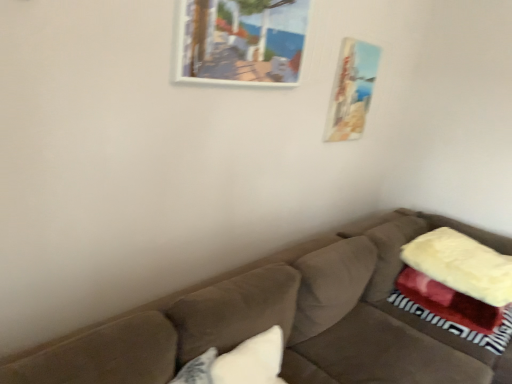
Identify the location of wooden picture frame at upper center, the 2th picture frame in the back-to-front sequence. (241, 41).

Between white soft pillow at lower center and wooden picture frame at upper center, placed as the first picture frame when sorted from front to back, which one has smaller width?

Thinner between the two is wooden picture frame at upper center, placed as the first picture frame when sorted from front to back.

Could wooden picture frame at upper center, the 2th picture frame in the back-to-front sequence, be considered to be inside white soft pillow at lower center?

No, white soft pillow at lower center does not contain wooden picture frame at upper center, the 2th picture frame in the back-to-front sequence.

Measure the distance from white soft pillow at lower center to wooden picture frame at upper center, acting as the 2th picture frame starting from the right.

The distance of white soft pillow at lower center from wooden picture frame at upper center, acting as the 2th picture frame starting from the right, is 3.52 feet.

Between white soft pillow at lower center and suede brown couch at center, which one has less height?

white soft pillow at lower center.

Is white soft pillow at lower center bigger or smaller than suede brown couch at center?

Clearly, white soft pillow at lower center is smaller in size than suede brown couch at center.

Is white soft pillow at lower center directly adjacent to suede brown couch at center?

No, white soft pillow at lower center is not with suede brown couch at center.

From the image's perspective, which one is positioned lower, white soft pillow at lower center or suede brown couch at center?

suede brown couch at center.

From the picture: Who is bigger, suede brown couch at center or white soft pillow at lower center?

suede brown couch at center is bigger.

Looking at this image, considering the sizes of objects suede brown couch at center and white soft pillow at lower center in the image provided, who is taller, suede brown couch at center or white soft pillow at lower center?

With more height is suede brown couch at center.

How many degrees apart are the facing directions of suede brown couch at center and white soft pillow at lower center?

20.6 degrees.

Does suede brown couch at center appear on the right side of white soft pillow at lower center?

Correct, you'll find suede brown couch at center to the right of white soft pillow at lower center.

How many degrees apart are the facing directions of white soft pillow at lower center and matte wooden picture frame at upper right, the 1th picture frame in the back-to-front sequence?

The angular difference between white soft pillow at lower center and matte wooden picture frame at upper right, the 1th picture frame in the back-to-front sequence, is 20.6 degrees.

Which is closer, (247, 375) or (345, 127)?

Point (247, 375) is positioned closer to the camera compared to point (345, 127).

Considering the sizes of objects white soft pillow at lower center and matte wooden picture frame at upper right, the second picture frame in the left-to-right sequence, in the image provided, who is smaller, white soft pillow at lower center or matte wooden picture frame at upper right, the second picture frame in the left-to-right sequence,?

matte wooden picture frame at upper right, the second picture frame in the left-to-right sequence, is smaller.

How different are the orientations of suede brown couch at center and matte wooden picture frame at upper right, the second picture frame in the left-to-right sequence, in degrees?

There is a 0.00239-degree angle between the facing directions of suede brown couch at center and matte wooden picture frame at upper right, the second picture frame in the left-to-right sequence.

Does suede brown couch at center turn towards matte wooden picture frame at upper right, the 1th picture frame in the back-to-front sequence?

No, suede brown couch at center is not facing towards matte wooden picture frame at upper right, the 1th picture frame in the back-to-front sequence.

Does suede brown couch at center have a larger size compared to matte wooden picture frame at upper right, the 1th picture frame in the back-to-front sequence?

Indeed, suede brown couch at center has a larger size compared to matte wooden picture frame at upper right, the 1th picture frame in the back-to-front sequence.

Identify the location of studio couch that appears below the matte wooden picture frame at upper right, the 1th picture frame in the back-to-front sequence (from the image's perspective). Image resolution: width=512 pixels, height=384 pixels. (286, 320).

From a real-world perspective, is wooden picture frame at upper center, placed as the first picture frame when sorted from front to back, positioned over white soft pillow at lower center based on gravity?

Yes, from a real-world perspective, wooden picture frame at upper center, placed as the first picture frame when sorted from front to back, is over white soft pillow at lower center

Is wooden picture frame at upper center, placed as the first picture frame when sorted from front to back, inside or outside of white soft pillow at lower center?

wooden picture frame at upper center, placed as the first picture frame when sorted from front to back, is not inside white soft pillow at lower center, it's outside.

Looking at this image, from the image's perspective, which one is positioned lower, wooden picture frame at upper center, which appears as the first picture frame when viewed from the left, or white soft pillow at lower center?

white soft pillow at lower center, from the image's perspective.

The image size is (512, 384). I want to click on the 1st picture frame behind the white soft pillow at lower center, so click(x=241, y=41).

Where is `pillow located below the matte wooden picture frame at upper right, the first picture frame from the right (from the image's perspective)`? The width and height of the screenshot is (512, 384). pillow located below the matte wooden picture frame at upper right, the first picture frame from the right (from the image's perspective) is located at coordinates click(x=251, y=361).

Is point (329, 123) closer to camera compared to point (275, 383)?

No, it is behind (275, 383).

Visually, is matte wooden picture frame at upper right, the second picture frame in the left-to-right sequence, positioned to the left or to the right of white soft pillow at lower center?

In the image, matte wooden picture frame at upper right, the second picture frame in the left-to-right sequence, appears on the right side of white soft pillow at lower center.

Is matte wooden picture frame at upper right, which is counted as the 2th picture frame, starting from the front, far away from white soft pillow at lower center?

Yes, matte wooden picture frame at upper right, which is counted as the 2th picture frame, starting from the front, and white soft pillow at lower center are located far from each other.

The width and height of the screenshot is (512, 384). I want to click on the 1st picture frame to the right of the white soft pillow at lower center, starting your count from the anchor, so click(x=241, y=41).

Locate an element on the screen. Image resolution: width=512 pixels, height=384 pixels. studio couch below the white soft pillow at lower center (from the image's perspective) is located at coordinates (286, 320).

Estimate the real-world distances between objects in this image. Which object is further from wooden picture frame at upper center, the 2th picture frame in the back-to-front sequence, white soft pillow at lower center or matte wooden picture frame at upper right, the second picture frame in the left-to-right sequence?

white soft pillow at lower center lies further to wooden picture frame at upper center, the 2th picture frame in the back-to-front sequence, than the other object.

Estimate the real-world distances between objects in this image. Which object is further from suede brown couch at center, white soft pillow at lower center or matte wooden picture frame at upper right, which is counted as the 2th picture frame, starting from the front?

Among the two, matte wooden picture frame at upper right, which is counted as the 2th picture frame, starting from the front, is located further to suede brown couch at center.

Based on their spatial positions, is wooden picture frame at upper center, placed as the first picture frame when sorted from front to back, or white soft pillow at lower center closer to suede brown couch at center?

white soft pillow at lower center.

Looking at the image, which one is located closer to white soft pillow at lower center, suede brown couch at center or wooden picture frame at upper center, the 2th picture frame in the back-to-front sequence?

suede brown couch at center is closer to white soft pillow at lower center.

Looking at the image, which one is located closer to wooden picture frame at upper center, placed as the first picture frame when sorted from front to back, matte wooden picture frame at upper right, the 1th picture frame in the back-to-front sequence, or suede brown couch at center?

The object closer to wooden picture frame at upper center, placed as the first picture frame when sorted from front to back, is matte wooden picture frame at upper right, the 1th picture frame in the back-to-front sequence.

Looking at the image, which one is located closer to white soft pillow at lower center, wooden picture frame at upper center, acting as the 2th picture frame starting from the right, or suede brown couch at center?

suede brown couch at center.

Based on their spatial positions, is suede brown couch at center or wooden picture frame at upper center, the 2th picture frame in the back-to-front sequence, closer to matte wooden picture frame at upper right, the first picture frame from the right?

Among the two, wooden picture frame at upper center, the 2th picture frame in the back-to-front sequence, is located nearer to matte wooden picture frame at upper right, the first picture frame from the right.

Estimate the real-world distances between objects in this image. Which object is further from wooden picture frame at upper center, which appears as the first picture frame when viewed from the left, white soft pillow at lower center or suede brown couch at center?

white soft pillow at lower center.

Locate an element on the screen. The height and width of the screenshot is (384, 512). pillow between suede brown couch at center and matte wooden picture frame at upper right, the second picture frame in the left-to-right sequence, along the z-axis is located at coordinates (251, 361).

Where is `picture frame between wooden picture frame at upper center, acting as the 2th picture frame starting from the right, and white soft pillow at lower center in the up-down direction`? The height and width of the screenshot is (384, 512). picture frame between wooden picture frame at upper center, acting as the 2th picture frame starting from the right, and white soft pillow at lower center in the up-down direction is located at coordinates coord(352,90).

This screenshot has height=384, width=512. What are the coordinates of `pillow between wooden picture frame at upper center, acting as the 2th picture frame starting from the right, and suede brown couch at center vertically` in the screenshot? It's located at (251, 361).

Locate an element on the screen. Image resolution: width=512 pixels, height=384 pixels. picture frame between suede brown couch at center and matte wooden picture frame at upper right, which is counted as the 2th picture frame, starting from the front, in the front-back direction is located at coordinates (241, 41).